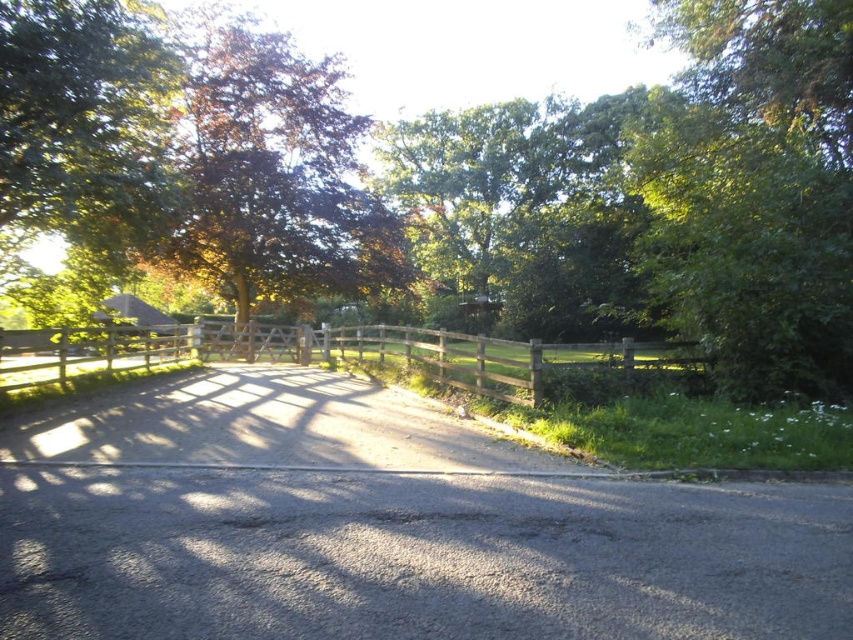
You are a delivery person with a cart that is 2 meters wide. You need to pass through the space between the brown leafy tree at center and the wooden fence at center. Can your cart fit through that space?

The distance between the brown leafy tree at center and the wooden fence at center is 5.73 meters, so the cart that is 2 meters wide can easily fit through the space between them.

You are a hiker planning to walk along the road towards the wooden gate. You notice a green leafy tree at center and a wooden fence at center. Which object would block your view more if you stand directly in front of them?

The green leafy tree at center has a larger size compared to the wooden fence at center, so it would block your view more than the wooden fence at center.

You are driving a tall truck that is 3 meters in height. You see the gray asphalt driveway at center and the brown leafy tree at center in the image. Can your truck pass under the tree without hitting it?

The gray asphalt driveway at center is not as tall as brown leafy tree at center, so the truck can pass under the tree as the tree is taller than the driveway height.